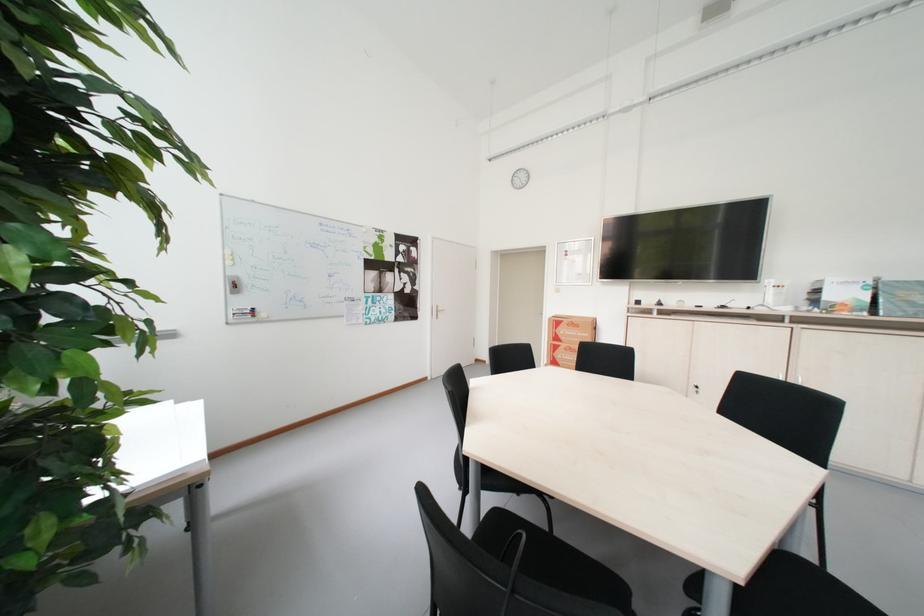
This screenshot has width=924, height=616. In order to click on white door handle in this screenshot , I will do `click(439, 310)`.